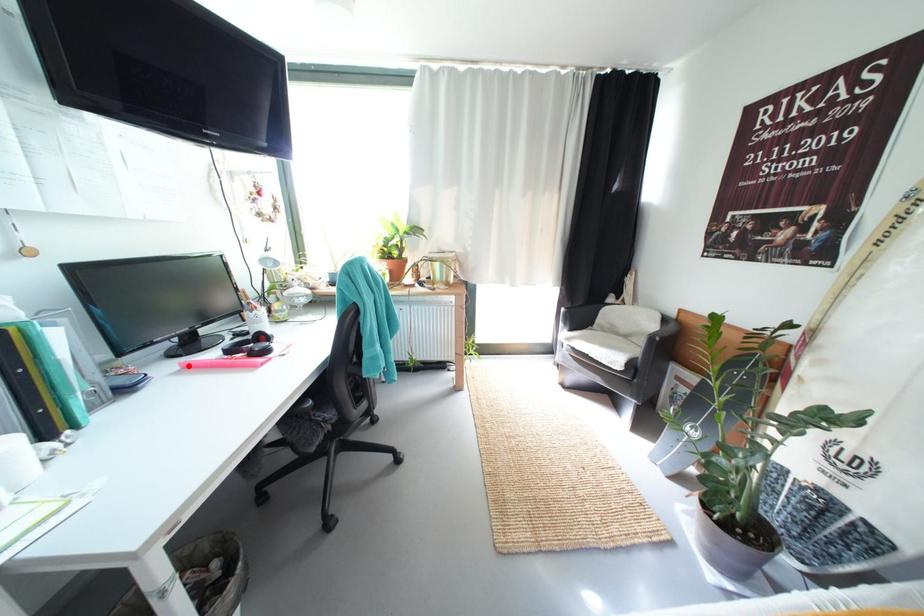
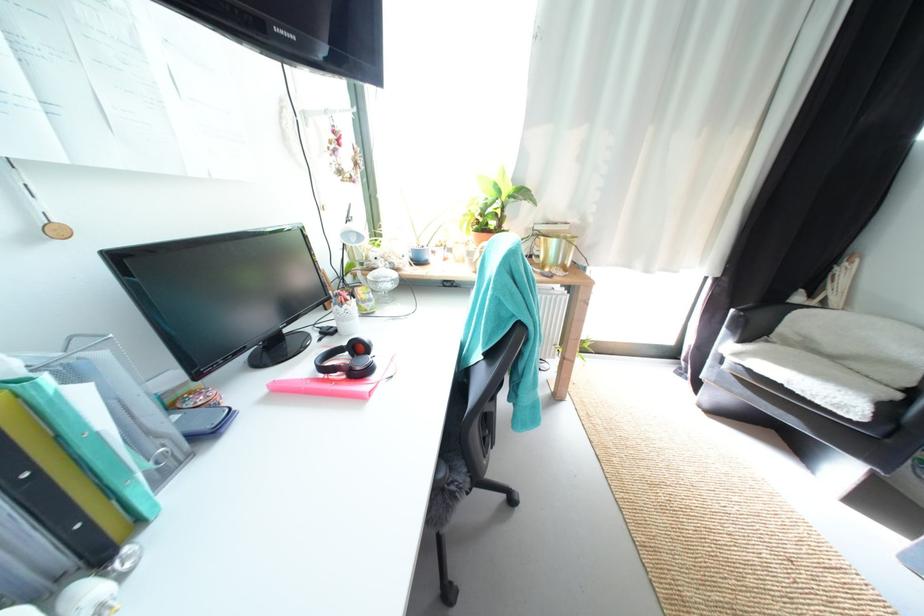
Find the pixel in the second image that matches the highlighted location in the first image.

(275, 387)